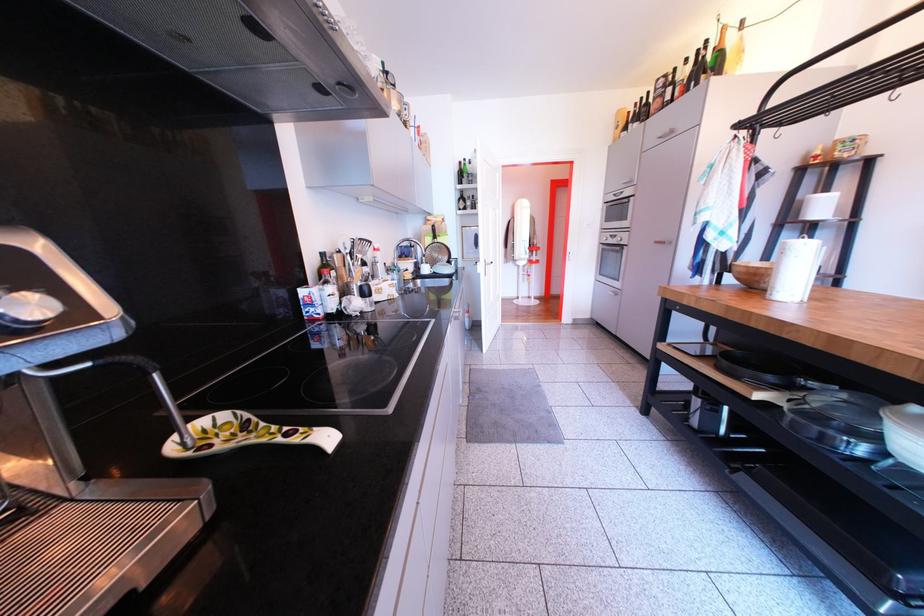
Image resolution: width=924 pixels, height=616 pixels. Identify the location of glass lid handle. (128, 385).